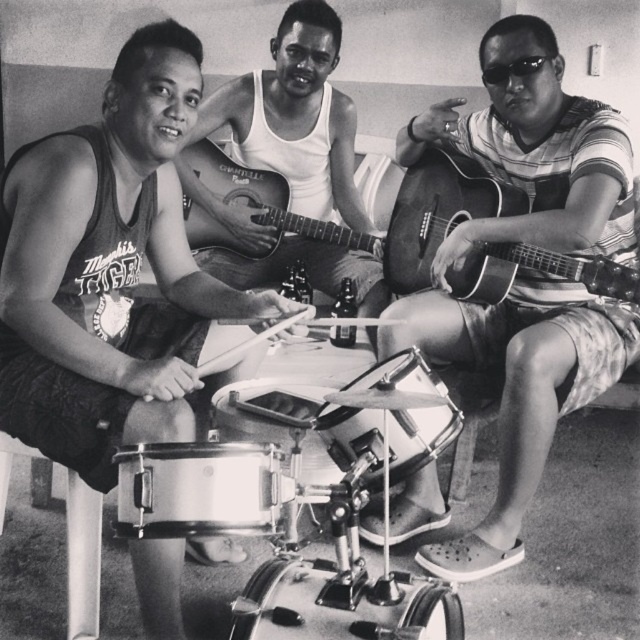
Question: Is matte white tank top at center below wooden acoustic guitar at right?

Choices:
 (A) yes
 (B) no

Answer: (B)

Question: Which object is the farthest from the matte brown guitar at right?

Choices:
 (A) metallic silver drum at center
 (B) wooden acoustic guitar at center
 (C) wooden acoustic guitar at right
 (D) shiny silver drum at center

Answer: (A)

Question: Estimate the real-world distances between objects in this image. Which object is closer to the wooden acoustic guitar at center?

Choices:
 (A) wooden acoustic guitar at right
 (B) shiny silver drum at center
 (C) metallic silver drum at center

Answer: (A)

Question: Can you confirm if metallic silver drum at center is wider than shiny metallic drum at lower center?

Choices:
 (A) yes
 (B) no

Answer: (B)

Question: Does metallic drum at lower left appear over shiny silver drum at center?

Choices:
 (A) no
 (B) yes

Answer: (B)

Question: Which of the following is the closest to the observer?

Choices:
 (A) matte brown guitar at right
 (B) wooden acoustic guitar at center
 (C) matte white tank top at center
 (D) metallic silver drum at center

Answer: (D)